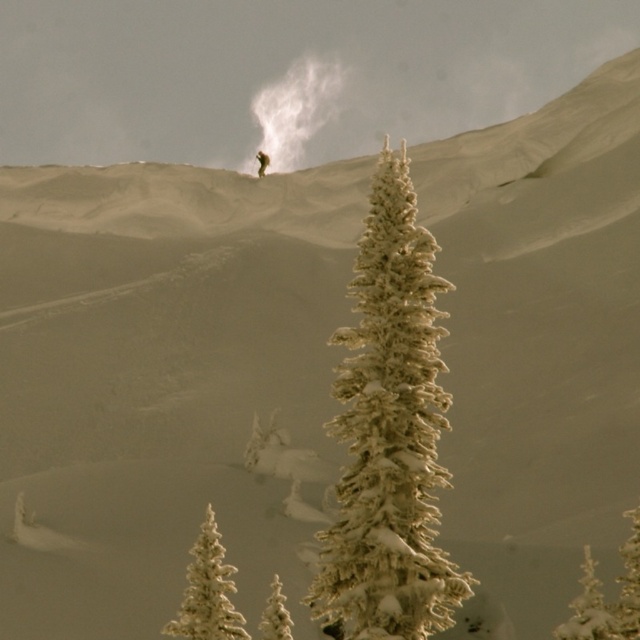
Question: Does white frosty tree at lower left appear on the left side of white frosty tree at lower center?

Choices:
 (A) yes
 (B) no

Answer: (A)

Question: Which object appears closest to the camera in this image?

Choices:
 (A) white frosty tree at lower center
 (B) white frosty tree at lower left

Answer: (A)

Question: Does white frosty tree at lower left lie behind white frosty tree at lower right?

Choices:
 (A) yes
 (B) no

Answer: (B)

Question: Which point appears farthest from the camera in this image?

Choices:
 (A) (381, 323)
 (B) (209, 566)
 (C) (568, 625)
 (D) (268, 630)

Answer: (C)

Question: Does white frosty tree at lower left have a greater width compared to white frosty tree at lower right?

Choices:
 (A) yes
 (B) no

Answer: (A)

Question: Which point is closer to the camera?

Choices:
 (A) (269, 632)
 (B) (584, 636)
 (C) (358, 364)
 (D) (225, 611)

Answer: (C)